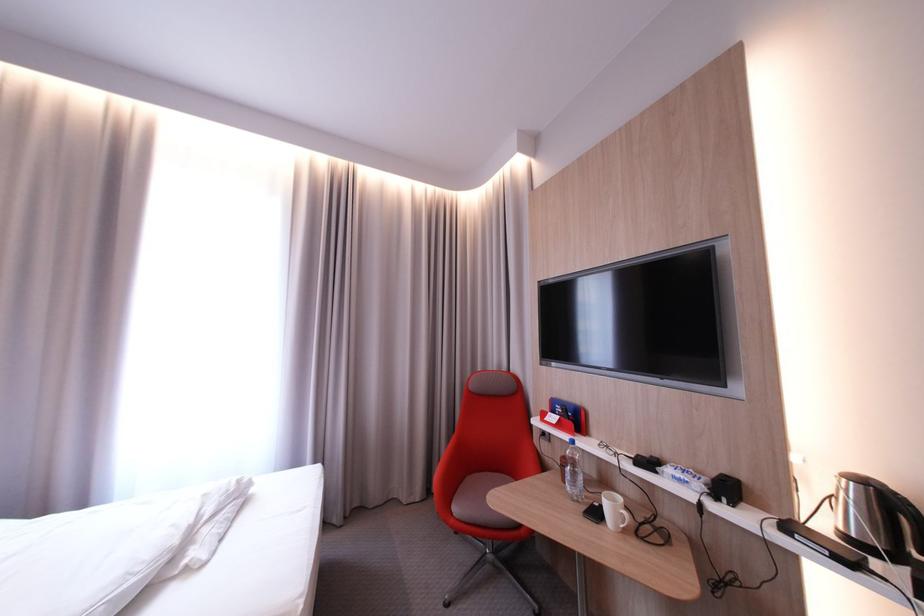
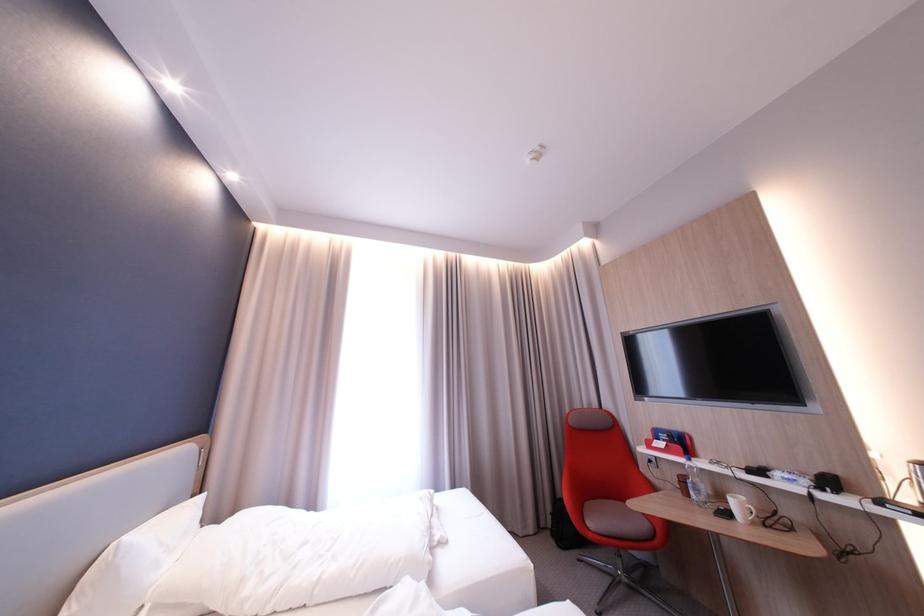
In a continuous first-person perspective shot, in which direction is the camera moving?

The movement direction of the cameraman is left, backward.